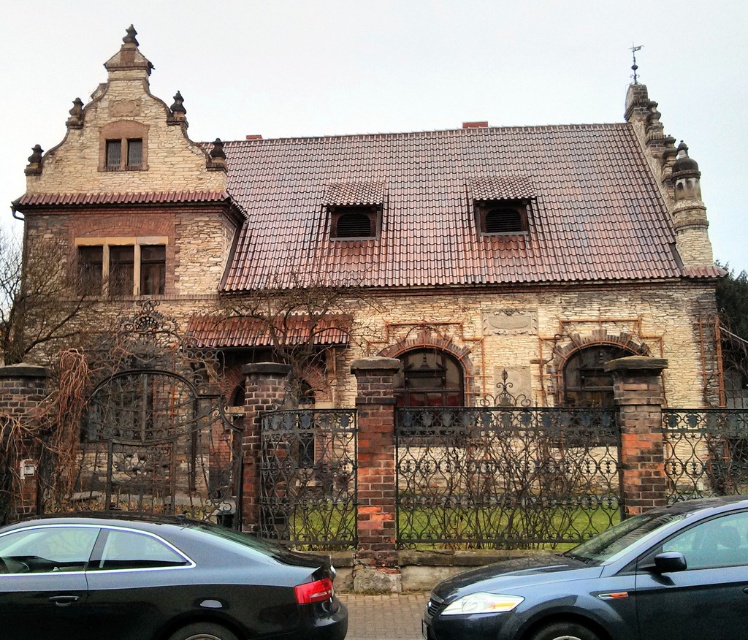
Does shiny black sedan at lower left lie behind metallic blue sedan at center?

No, it is not.

Which is above, shiny black sedan at lower left or metallic blue sedan at center?

shiny black sedan at lower left is above.

What do you see at coordinates (159, 582) in the screenshot? I see `shiny black sedan at lower left` at bounding box center [159, 582].

At what (x,y) coordinates should I click in order to perform the action: click on shiny black sedan at lower left. Please return your answer as a coordinate pair (x, y). This screenshot has height=640, width=748. Looking at the image, I should click on (159, 582).